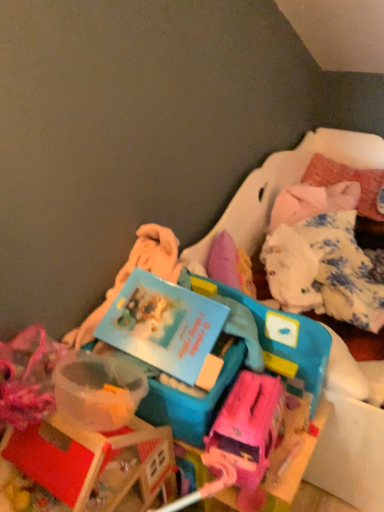
Question: Does blue plastic book at center have a smaller size compared to matte pink suitcase at center?

Choices:
 (A) yes
 (B) no

Answer: (B)

Question: Is the depth of blue plastic book at center less than that of matte pink suitcase at center?

Choices:
 (A) no
 (B) yes

Answer: (B)

Question: Does blue plastic book at center have a larger size compared to matte pink suitcase at center?

Choices:
 (A) no
 (B) yes

Answer: (B)

Question: Is blue plastic book at center further to the viewer compared to matte pink suitcase at center?

Choices:
 (A) no
 (B) yes

Answer: (A)

Question: Is blue plastic book at center not within matte pink suitcase at center?

Choices:
 (A) no
 (B) yes

Answer: (B)

Question: Is blue plastic book at center to the left or to the right of blue plastic storage box at center, which is counted as the 1th storage box, starting from the left, in the image?

Choices:
 (A) right
 (B) left

Answer: (B)

Question: Is blue plastic book at center in front of or behind blue plastic storage box at center, which is the second storage box in right-to-left order, in the image?

Choices:
 (A) front
 (B) behind

Answer: (A)

Question: Is blue plastic book at center inside the boundaries of blue plastic storage box at center, which is the second storage box in right-to-left order, or outside?

Choices:
 (A) outside
 (B) inside

Answer: (A)

Question: From a real-world perspective, is blue plastic book at center physically located above or below blue plastic storage box at center, which is the second storage box in right-to-left order?

Choices:
 (A) above
 (B) below

Answer: (A)

Question: Visually, is fluffy pink pillow at upper right positioned to the left or to the right of blue plastic storage box at center, which ranks as the 1th storage box in right-to-left order?

Choices:
 (A) right
 (B) left

Answer: (A)

Question: Considering the positions of fluffy pink pillow at upper right and blue plastic storage box at center, which ranks as the 1th storage box in right-to-left order, in the image, is fluffy pink pillow at upper right taller or shorter than blue plastic storage box at center, which ranks as the 1th storage box in right-to-left order,?

Choices:
 (A) short
 (B) tall

Answer: (A)

Question: Looking at their shapes, would you say fluffy pink pillow at upper right is wider or thinner than blue plastic storage box at center, which ranks as the second storage box in left-to-right order?

Choices:
 (A) wide
 (B) thin

Answer: (B)

Question: From a real-world perspective, is fluffy pink pillow at upper right positioned above or below blue plastic storage box at center, which ranks as the second storage box in left-to-right order?

Choices:
 (A) below
 (B) above

Answer: (A)

Question: Is blue plastic book at center wider or thinner than matte pink suitcase at center?

Choices:
 (A) thin
 (B) wide

Answer: (B)

Question: From the image's perspective, is blue plastic book at center above or below matte pink suitcase at center?

Choices:
 (A) above
 (B) below

Answer: (A)